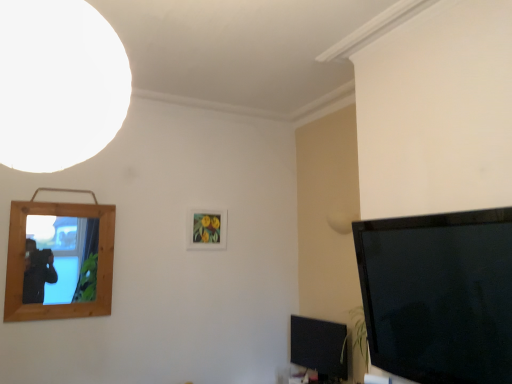
Question: Considering their positions, is white matte light at upper left located in front of or behind black glossy tv at lower right?

Choices:
 (A) front
 (B) behind

Answer: (A)

Question: Considering the positions of white matte light at upper left and black glossy tv at lower right in the image, is white matte light at upper left wider or thinner than black glossy tv at lower right?

Choices:
 (A) wide
 (B) thin

Answer: (A)

Question: Based on their relative distances, which object is farther from the matte wooden picture frame at center, which is the first picture frame in right-to-left order?

Choices:
 (A) white matte light at upper left
 (B) black glossy tv at lower right
 (C) wooden mirror at left, placed as the 2th picture frame when sorted from right to left

Answer: (A)

Question: Based on their relative distances, which object is nearer to the wooden mirror at left, which is the second picture frame in back-to-front order?

Choices:
 (A) matte wooden picture frame at center, positioned as the first picture frame in back-to-front order
 (B) white matte light at upper left
 (C) black glossy tv at lower right

Answer: (A)